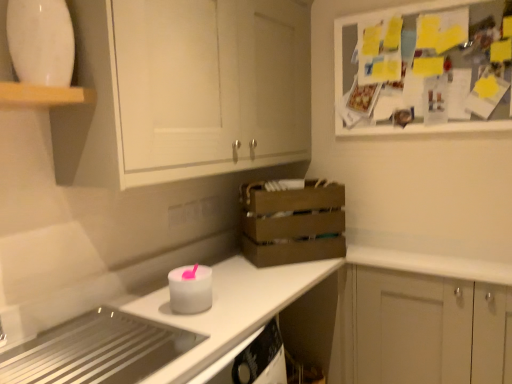
Question: Should I look upward or downward to see white matte cabinet at upper left, the 1th cabinetry from the top?

Choices:
 (A) up
 (B) down

Answer: (A)

Question: Is white matte cabinet at lower right, arranged as the second cabinetry when viewed from the top, positioned in front of brown wooden crate at center?

Choices:
 (A) no
 (B) yes

Answer: (B)

Question: Can you confirm if white matte cabinet at lower right, which appears as the second cabinetry when viewed from the left, is positioned to the left of brown wooden crate at center?

Choices:
 (A) no
 (B) yes

Answer: (A)

Question: Does white matte cabinet at lower right, which is the first cabinetry in right-to-left order, contain brown wooden crate at center?

Choices:
 (A) no
 (B) yes

Answer: (A)

Question: Is white matte cabinet at lower right, arranged as the second cabinetry when viewed from the top, further to camera compared to brown wooden crate at center?

Choices:
 (A) no
 (B) yes

Answer: (A)

Question: Is white matte cabinet at lower right, arranged as the second cabinetry when viewed from the top, completely or partially outside of brown wooden crate at center?

Choices:
 (A) yes
 (B) no

Answer: (A)

Question: Does white matte cabinet at lower right, which is the first cabinetry in right-to-left order, have a lesser height compared to brown wooden crate at center?

Choices:
 (A) no
 (B) yes

Answer: (A)

Question: Does metallic stainless steel cooktop at lower left, acting as the 3th appliance starting from the top, appear on the right side of brown wooden crate at center?

Choices:
 (A) no
 (B) yes

Answer: (A)

Question: Is metallic stainless steel cooktop at lower left, the first appliance when ordered from bottom to top, touching brown wooden crate at center?

Choices:
 (A) yes
 (B) no

Answer: (B)

Question: From a real-world perspective, is metallic stainless steel cooktop at lower left, acting as the 3th appliance starting from the top, beneath brown wooden crate at center?

Choices:
 (A) no
 (B) yes

Answer: (B)

Question: Does metallic stainless steel cooktop at lower left, acting as the 3th appliance starting from the top, appear on the left side of brown wooden crate at center?

Choices:
 (A) no
 (B) yes

Answer: (B)

Question: Is metallic stainless steel cooktop at lower left, the first appliance when ordered from bottom to top, far away from brown wooden crate at center?

Choices:
 (A) yes
 (B) no

Answer: (B)

Question: Does metallic stainless steel cooktop at lower left, acting as the 3th appliance starting from the top, have a greater width compared to brown wooden crate at center?

Choices:
 (A) no
 (B) yes

Answer: (B)

Question: Does brown wooden crate at center have a smaller size compared to white matte candle at center, the 2th appliance ordered from the bottom?

Choices:
 (A) no
 (B) yes

Answer: (A)